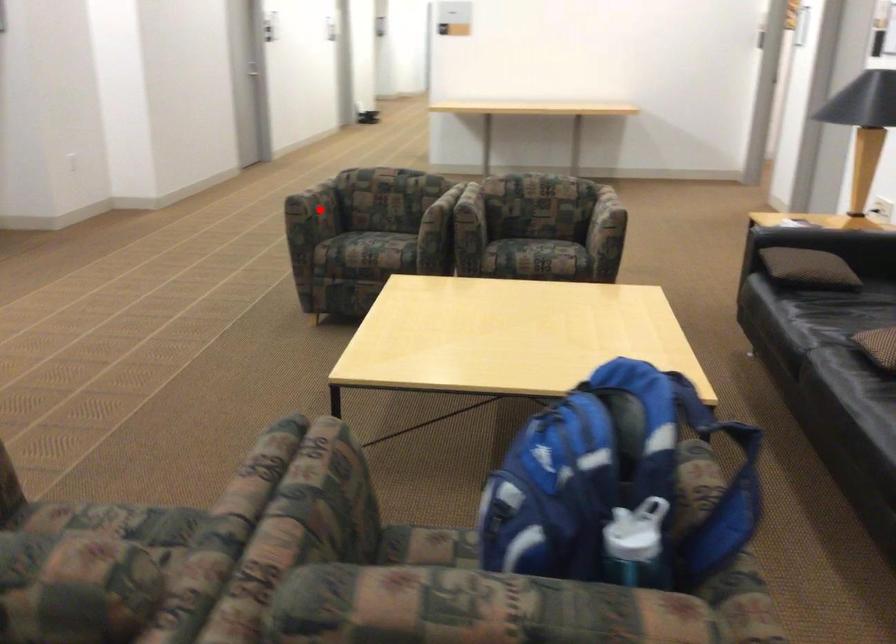
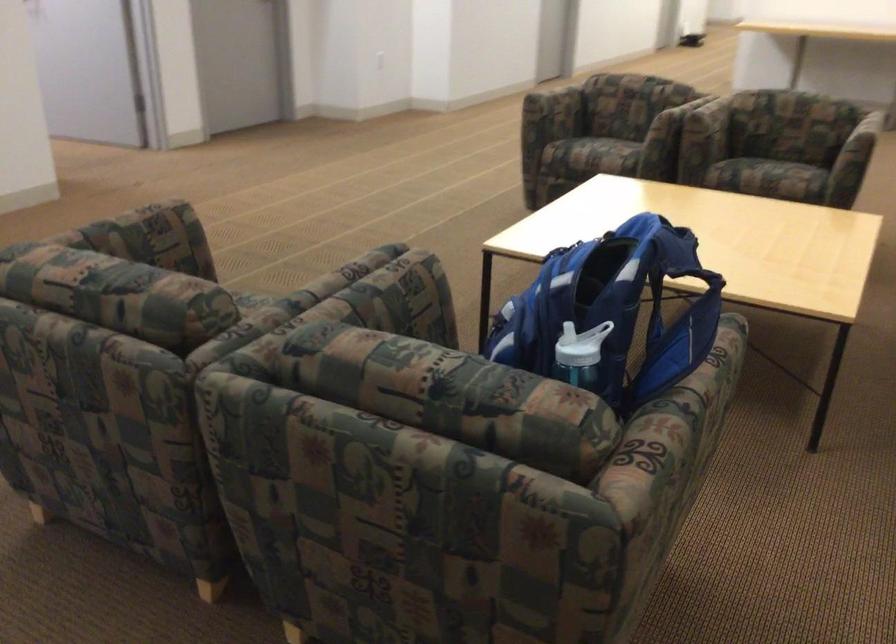
The point at the highlighted location is marked in the first image. Where is the corresponding point in the second image?

(554, 108)